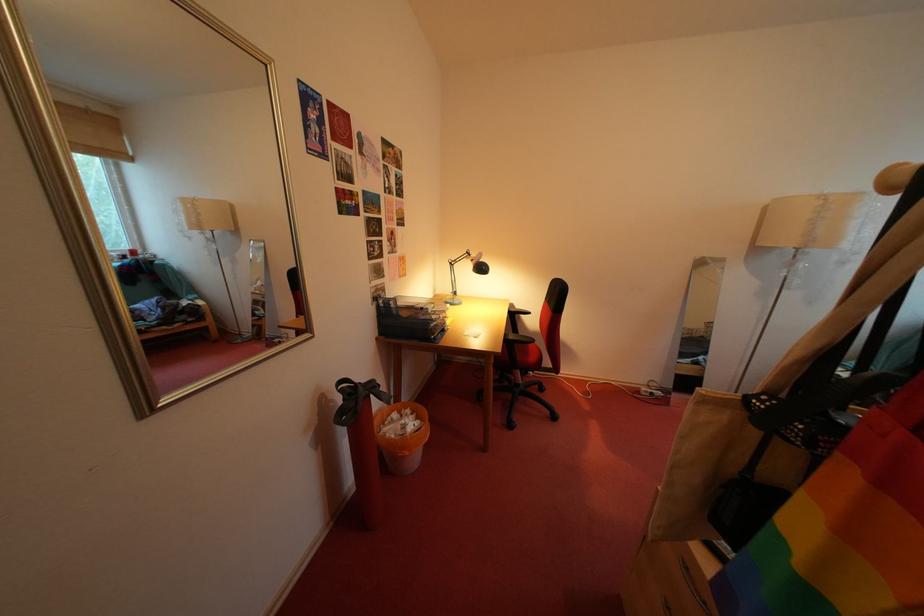
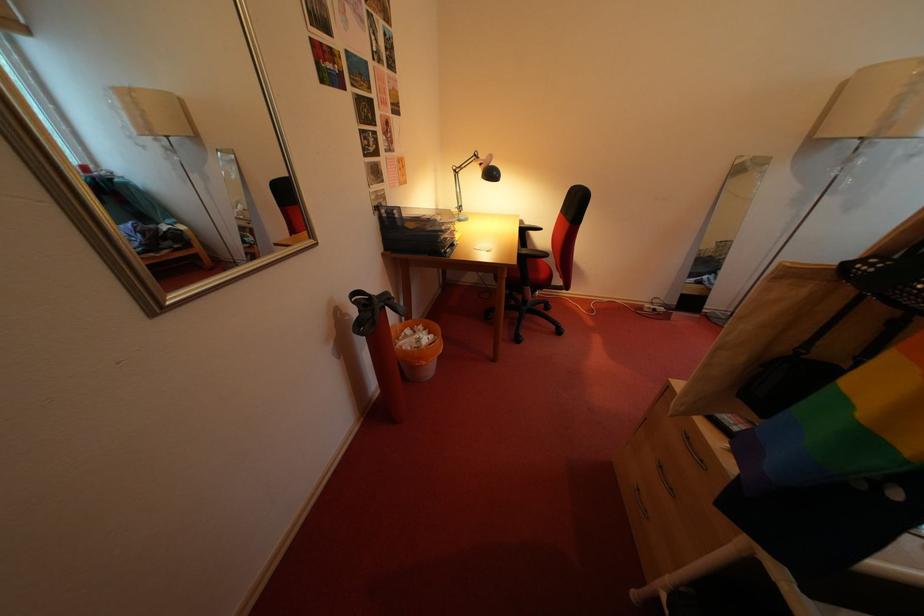
The point at [448,297] is marked in the first image. Where is the corresponding point in the second image?

(451, 214)